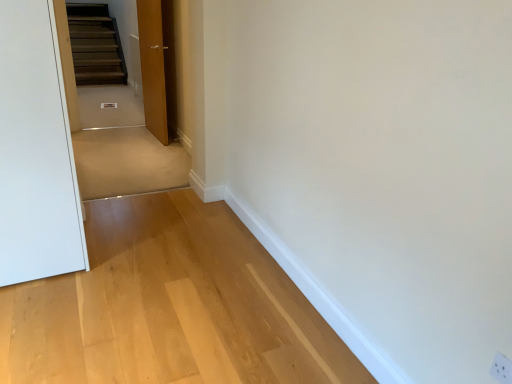
Question: Should I look upward or downward to see matte wood door at center?

Choices:
 (A) up
 (B) down

Answer: (A)

Question: Is white plastic outlet at lower right shorter than matte wood door at center?

Choices:
 (A) no
 (B) yes

Answer: (B)

Question: Does white plastic outlet at lower right have a smaller size compared to matte wood door at center?

Choices:
 (A) no
 (B) yes

Answer: (B)

Question: Is white plastic outlet at lower right closer to camera compared to matte wood door at center?

Choices:
 (A) yes
 (B) no

Answer: (A)

Question: Is white plastic outlet at lower right in contact with matte wood door at center?

Choices:
 (A) no
 (B) yes

Answer: (A)

Question: Is white plastic outlet at lower right aimed at matte wood door at center?

Choices:
 (A) no
 (B) yes

Answer: (A)

Question: Considering the relative positions of white plastic outlet at lower right and matte wood door at center in the image provided, is white plastic outlet at lower right to the left of matte wood door at center from the viewer's perspective?

Choices:
 (A) no
 (B) yes

Answer: (A)

Question: Does matte wood door at center lie in front of white plastic outlet at lower right?

Choices:
 (A) yes
 (B) no

Answer: (B)

Question: From the image's perspective, is matte wood door at center on top of white plastic outlet at lower right?

Choices:
 (A) no
 (B) yes

Answer: (B)

Question: Is matte wood door at center far away from white plastic outlet at lower right?

Choices:
 (A) yes
 (B) no

Answer: (A)

Question: Does matte wood door at center turn towards white plastic outlet at lower right?

Choices:
 (A) yes
 (B) no

Answer: (B)

Question: Considering the relative positions of matte wood door at center and white plastic outlet at lower right in the image provided, is matte wood door at center to the right of white plastic outlet at lower right from the viewer's perspective?

Choices:
 (A) no
 (B) yes

Answer: (A)

Question: From the image's perspective, would you say matte wood door at center is shown under white plastic outlet at lower right?

Choices:
 (A) yes
 (B) no

Answer: (B)

Question: Is point click(x=151, y=67) positioned closer to the camera than point click(x=497, y=355)?

Choices:
 (A) closer
 (B) farther

Answer: (B)